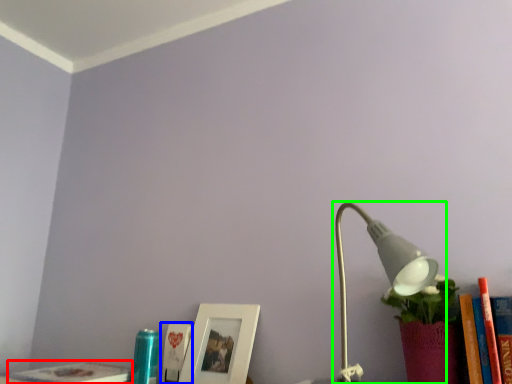
Question: Which object is positioned farthest from book (highlighted by a red box)? Select from book (highlighted by a blue box) and lamp (highlighted by a green box).

Choices:
 (A) book
 (B) lamp

Answer: (B)